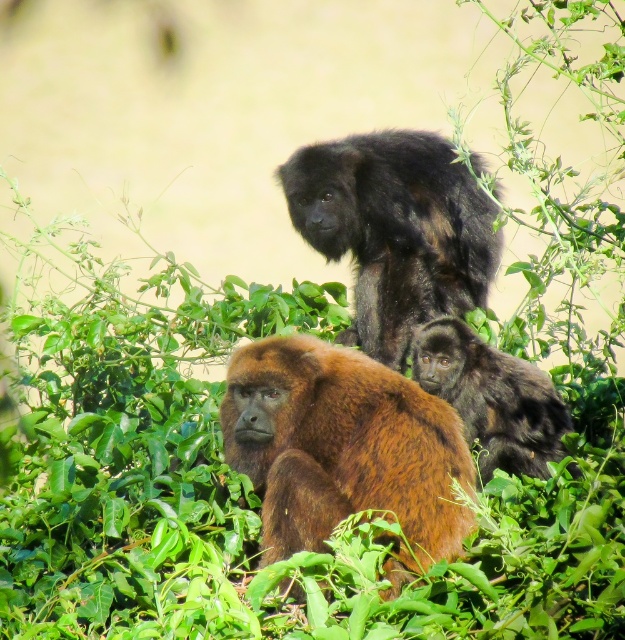
You are a photographer aiming to capture a photo of the brown furry monkey at center and the shiny black monkey at upper center. You want to ensure both are visible in the frame. Based on their positions, which monkey is closer to the left side of the photo?

The brown furry monkey at center is to the left of shiny black monkey at upper center, so the brown furry monkey at center is closer to the left side of the photo.

You are standing in a forest and see a point marked at coordinates (342, 449). What animal is located exactly at that point?

The brown furry monkey at center is located exactly at point (342, 449).

You are standing in a forest and see the brown furry monkey at center. If you want to locate it precisely using a coordinate system where the bottom left corner is the origin, what are its coordinates?

The coordinates of the brown furry monkey at center are at point (342,449).